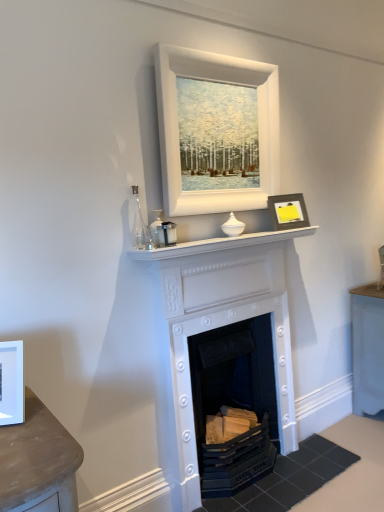
Question: Is white matte picture frame at upper center, placed as the second picture frame when sorted from front to back, taller or shorter than white glossy mantle at center?

Choices:
 (A) tall
 (B) short

Answer: (A)

Question: Looking at the image, does white matte picture frame at upper center, marked as the 3th picture frame in a bottom-to-top arrangement, seem bigger or smaller compared to white glossy mantle at center?

Choices:
 (A) big
 (B) small

Answer: (A)

Question: Based on their relative distances, which object is nearer to the white painted wood fireplace at center, arranged as the 2th fireplace when viewed from the top?

Choices:
 (A) white painted fireplace at center, which is the first fireplace in top-to-bottom order
 (B) matte black frame at upper right, the first picture frame positioned from the back
 (C) white glossy mantle at center
 (D) white matte picture frame at upper center, marked as the second picture frame in a left-to-right arrangement
 (E) white matte picture frame at left, placed as the first picture frame when sorted from front to back

Answer: (A)

Question: Which object is the closest to the white painted wood fireplace at center, arranged as the 2th fireplace when viewed from the top?

Choices:
 (A) white glossy mantle at center
 (B) white matte picture frame at left, which is the third picture frame in top-to-bottom order
 (C) white matte picture frame at upper center, which is the 1th picture frame in top-to-bottom order
 (D) matte black frame at upper right, which is the 3th picture frame in front-to-back order
 (E) white painted fireplace at center, placed as the 2th fireplace when sorted from bottom to top

Answer: (E)